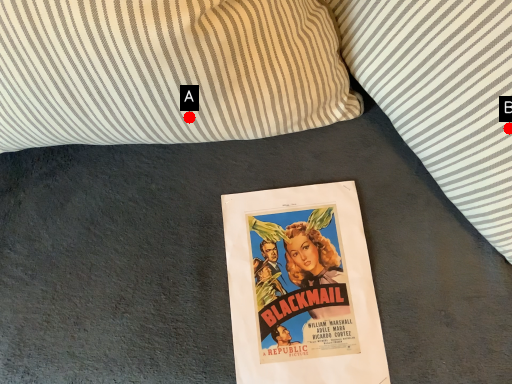
Question: Two points are circled on the image, labeled by A and B beside each circle. Which point is closer to the camera?

Choices:
 (A) A is closer
 (B) B is closer

Answer: (B)